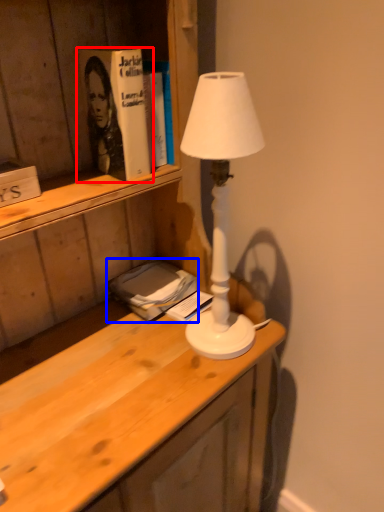
Question: Among these objects, which one is nearest to the camera, paperback book (highlighted by a red box) or book (highlighted by a blue box)?

Choices:
 (A) paperback book
 (B) book

Answer: (A)